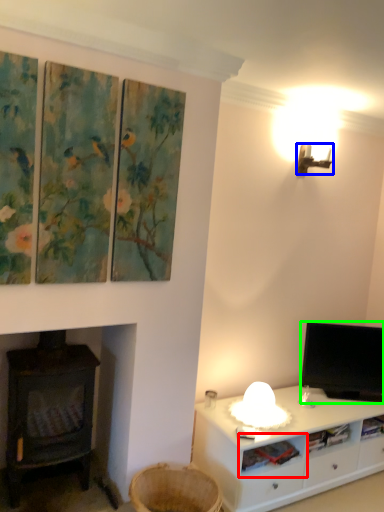
Question: Which is farther away from shelf (highlighted by a red box)? lamp (highlighted by a blue box) or television (highlighted by a green box)?

Choices:
 (A) lamp
 (B) television

Answer: (A)